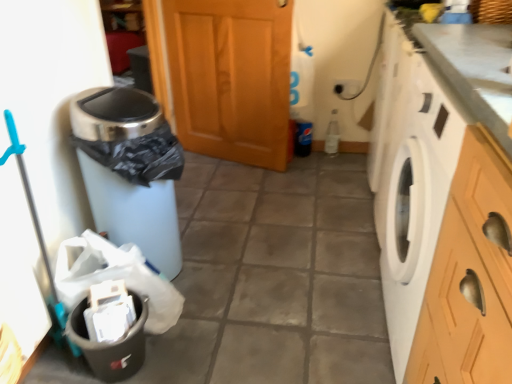
At what (x,y) coordinates should I click in order to perform the action: click on vacant space underneath wooden door at center (from a real-world perspective). Please return your answer as a coordinate pair (x, y). The height and width of the screenshot is (384, 512). Looking at the image, I should click on (229, 154).